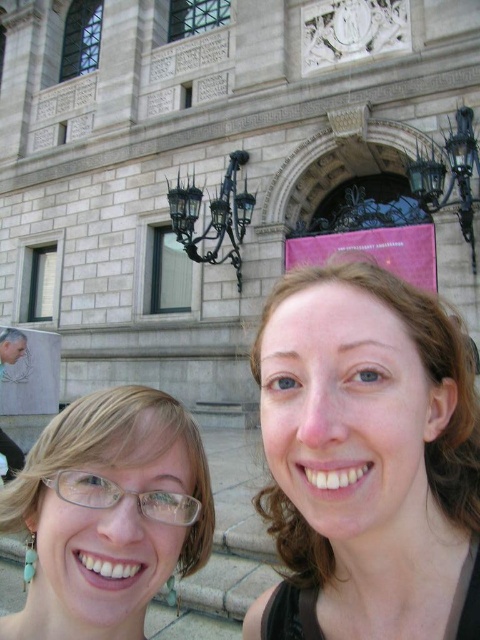
Question: Is smooth skin face at center above clear plastic glasses at center?

Choices:
 (A) no
 (B) yes

Answer: (B)

Question: In this image, where is smooth skin face at center located relative to clear plastic glasses at center?

Choices:
 (A) below
 (B) above

Answer: (B)

Question: Does smooth skin face at center appear on the right side of clear plastic glasses at center?

Choices:
 (A) no
 (B) yes

Answer: (B)

Question: Which point is closer to the camera taking this photo?

Choices:
 (A) (208, 536)
 (B) (300, 442)

Answer: (B)

Question: Which object appears closest to the camera in this image?

Choices:
 (A) clear plastic glasses at center
 (B) smooth skin face at center

Answer: (B)